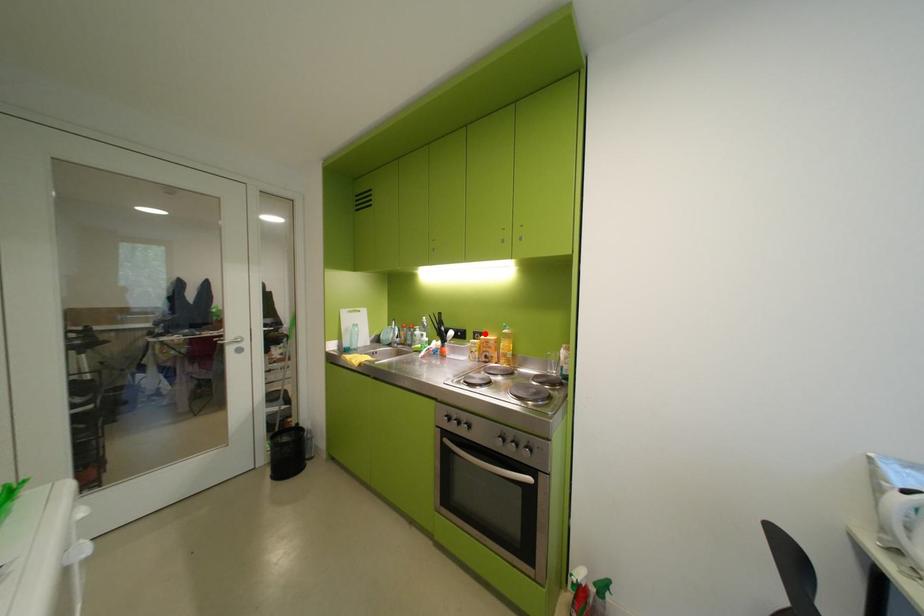
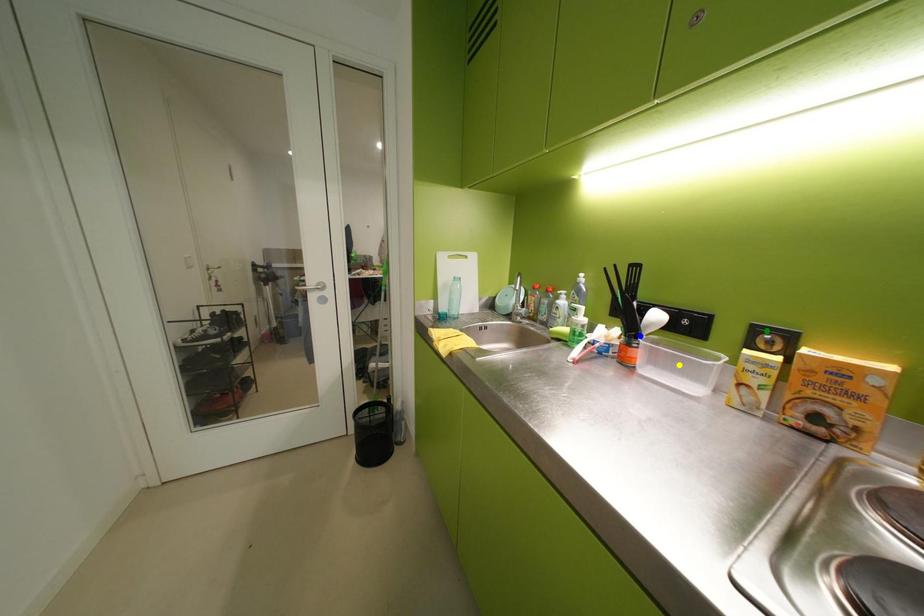
Question: I am providing you with two images of the same scene from different viewpoints. A red point is marked on the first image. You are given multiple points on the second image. Which point in image 2 is actually the same real-world point as the red point in image 1?

Choices:
 (A) blue point
 (B) green point
 (C) yellow point

Answer: (B)